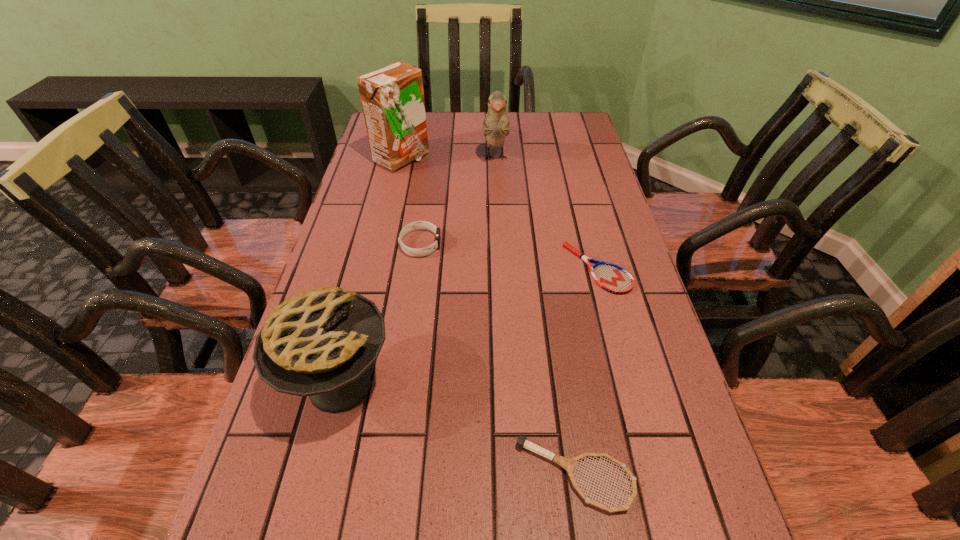
The image size is (960, 540). What are the coordinates of `carton` in the screenshot? It's located at (392, 97).

Locate an element on the screen. bird is located at coordinates (496, 126).

Identify the location of the third tallest object. (319, 343).

This screenshot has height=540, width=960. Identify the location of the third shortest object. (420, 252).

Find the location of a particular element. the fifth tallest object is located at coordinates [569, 464].

Image resolution: width=960 pixels, height=540 pixels. In order to click on the nearer tennis racket in this screenshot , I will do `click(569, 464)`.

Identify the location of the shortest object. The width and height of the screenshot is (960, 540). (612, 278).

Find the location of a particular element. The image size is (960, 540). the farther tennis racket is located at coordinates (612, 278).

I want to click on free space located on the straw side of the carton, so click(x=451, y=159).

At what (x,y) coordinates should I click in order to perform the action: click on free spot located 0.380m at the face of the fifth shortest object. Please return your answer as a coordinate pair (x, y). Image resolution: width=960 pixels, height=540 pixels. Looking at the image, I should click on (500, 265).